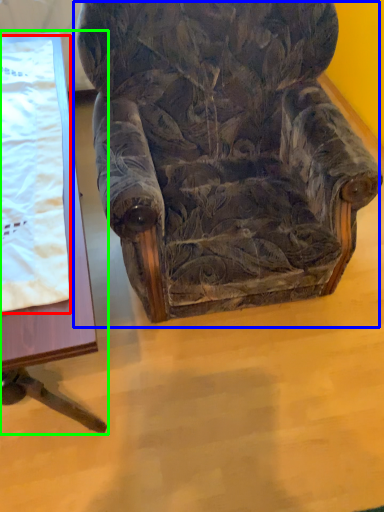
Question: Which is nearer to the blanket (highlighted by a red box)? chair (highlighted by a blue box) or table (highlighted by a green box).

Choices:
 (A) chair
 (B) table

Answer: (B)